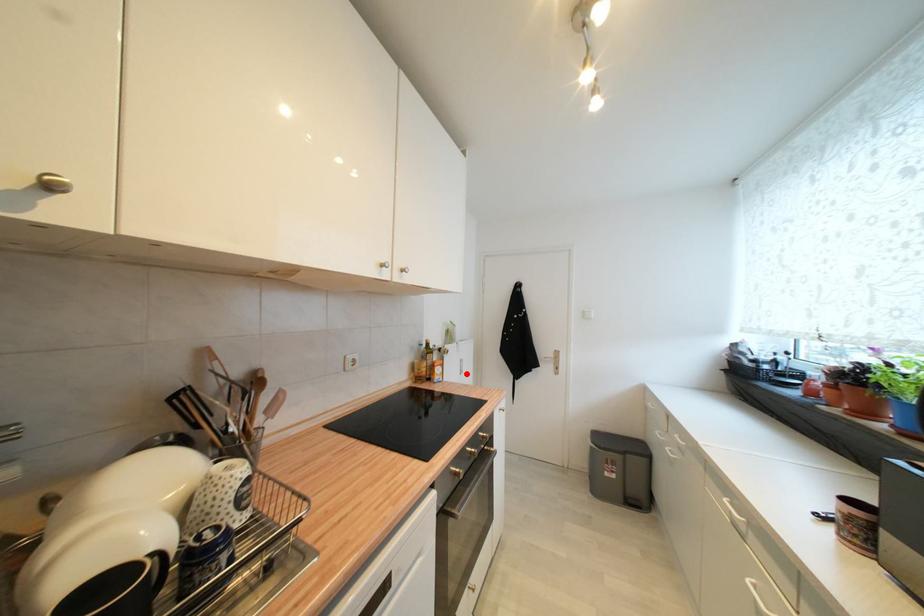
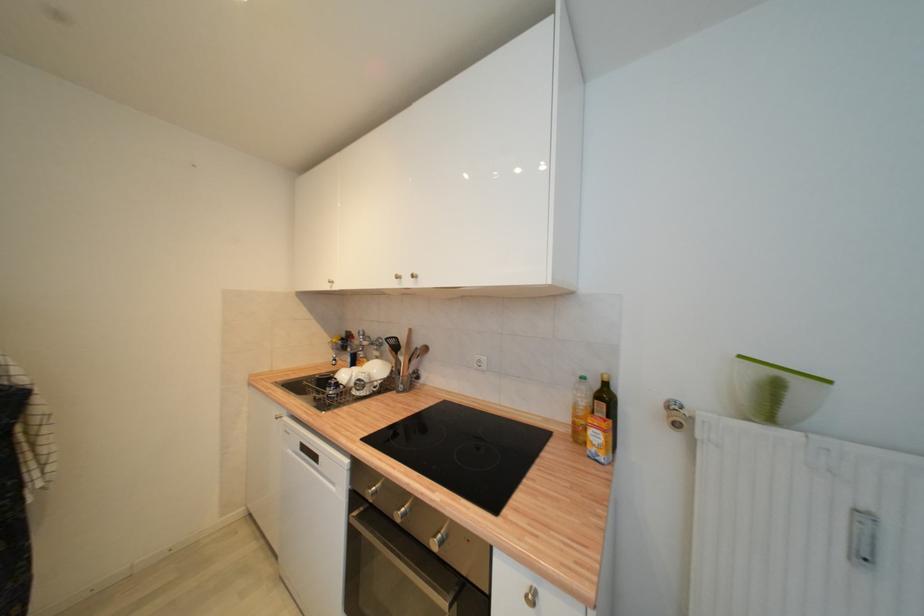
In the second image, find the point that corresponds to the highlighted location in the first image.

(869, 560)